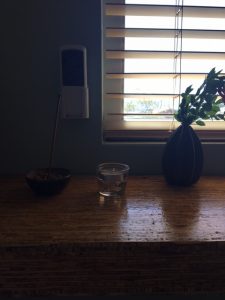
Identify the location of black vase. Image resolution: width=225 pixels, height=300 pixels. (189, 153).